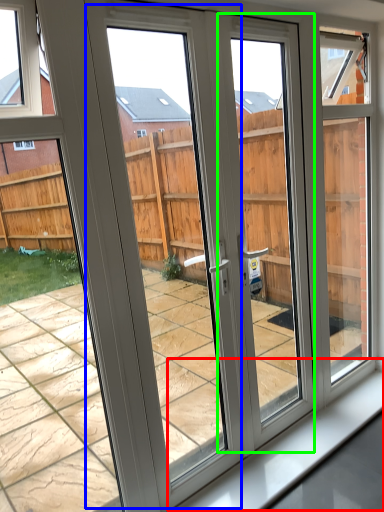
Question: Considering the real-world distances, which object is farthest from window sill (highlighted by a red box)? screen door (highlighted by a blue box) or screen door (highlighted by a green box)?

Choices:
 (A) screen door
 (B) screen door

Answer: (A)